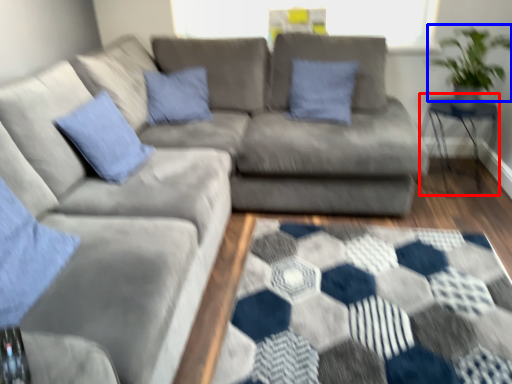
Question: Which object is further to the camera taking this photo, table (highlighted by a red box) or plant (highlighted by a blue box)?

Choices:
 (A) table
 (B) plant

Answer: (A)